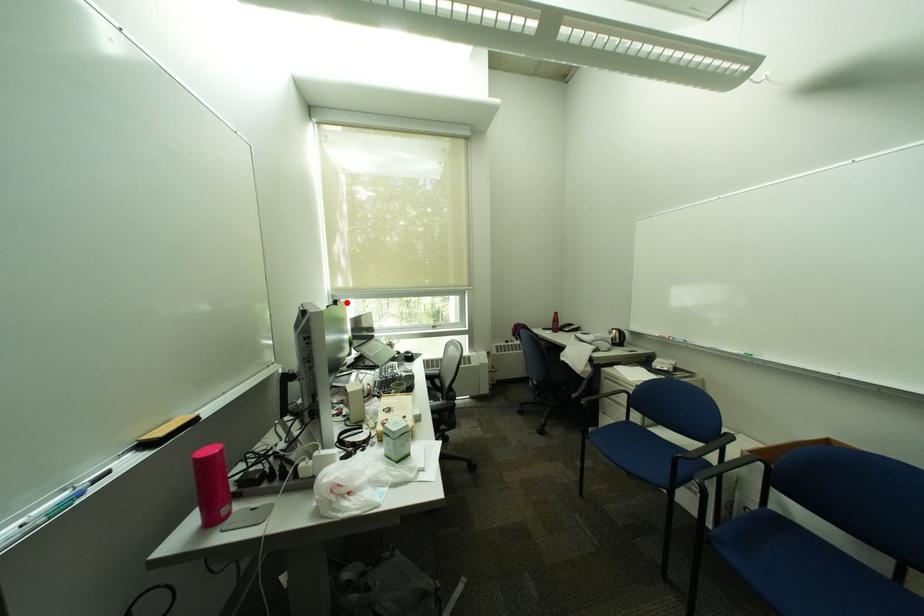
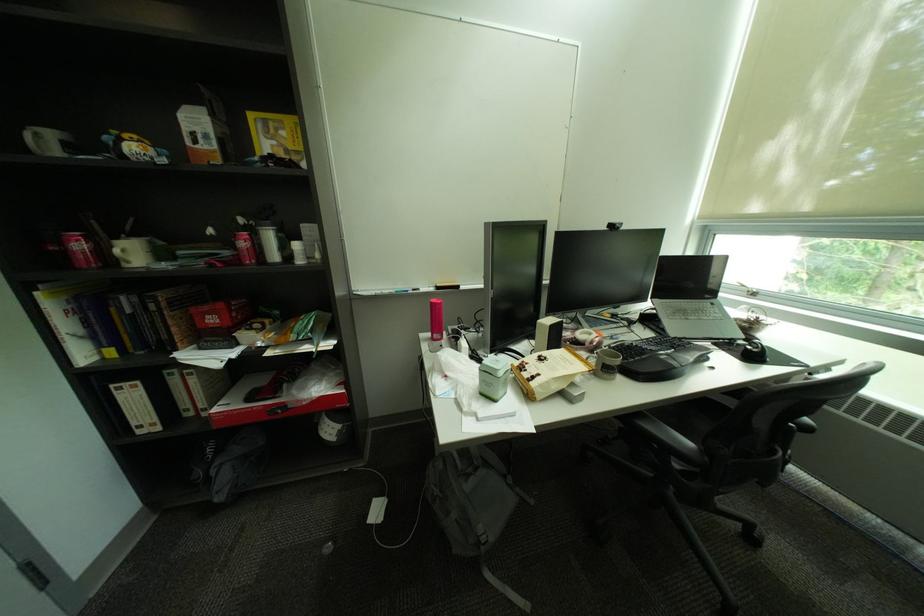
Where in the second image is the point corresponding to the highlighted location from the first image?

(621, 227)